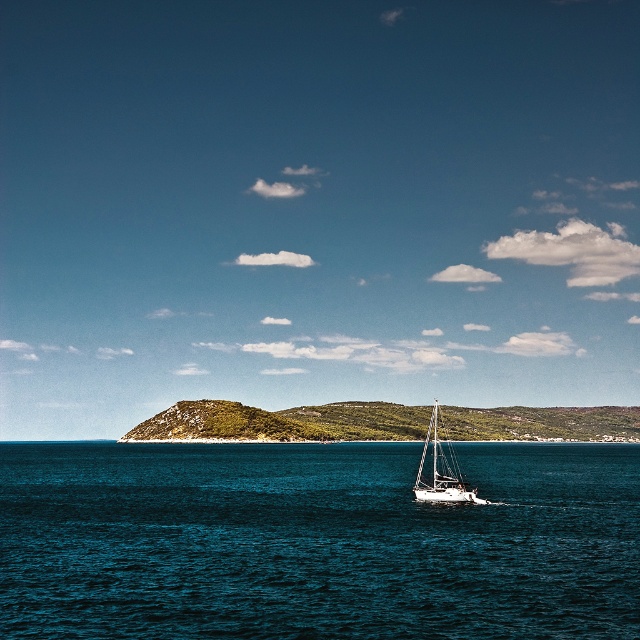
Question: Can you confirm if deep blue water at center is positioned below white glossy sailboat at center?

Choices:
 (A) no
 (B) yes

Answer: (A)

Question: Where is green grassy hill at center located in relation to white glossy sailboat at center in the image?

Choices:
 (A) below
 (B) above

Answer: (A)

Question: Which object is positioned farthest from the green grassy hill at center?

Choices:
 (A) deep blue water at center
 (B) white glossy sailboat at center

Answer: (A)

Question: Is deep blue water at center further to the viewer compared to white glossy sailboat at center?

Choices:
 (A) no
 (B) yes

Answer: (A)

Question: Which object is farther from the camera taking this photo?

Choices:
 (A) green grassy hill at center
 (B) deep blue water at center
 (C) white glossy sailboat at center

Answer: (A)

Question: Among these points, which one is farthest from the camera?

Choices:
 (A) (460, 488)
 (B) (144, 544)

Answer: (A)